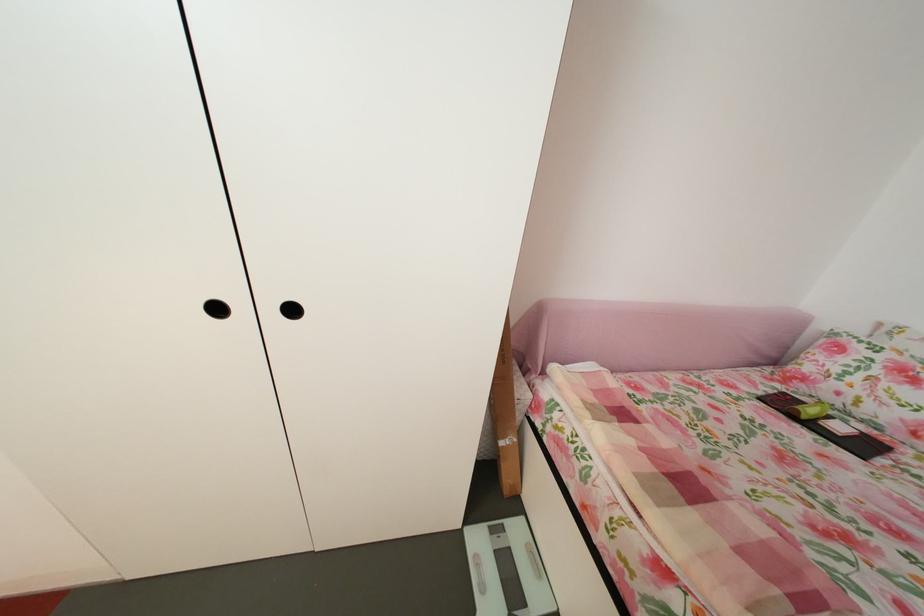
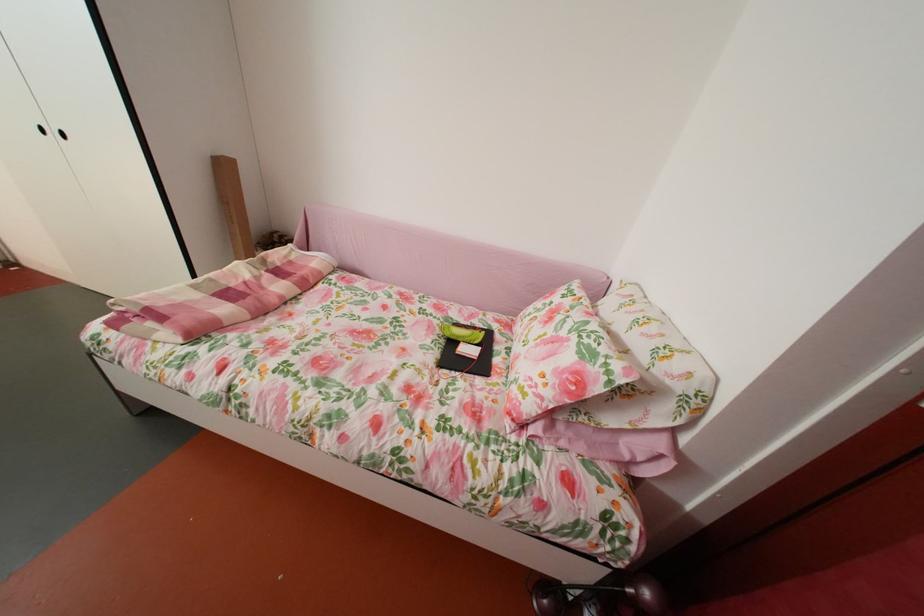
Locate, in the second image, the point that corresponds to point 772,400 in the first image.

(473, 328)